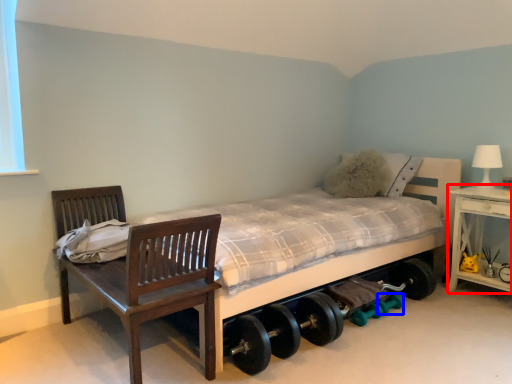
Question: Which of the following is the closest to the observer, nightstand (highlighted by a red box) or dumbbell (highlighted by a blue box)?

Choices:
 (A) nightstand
 (B) dumbbell

Answer: (A)